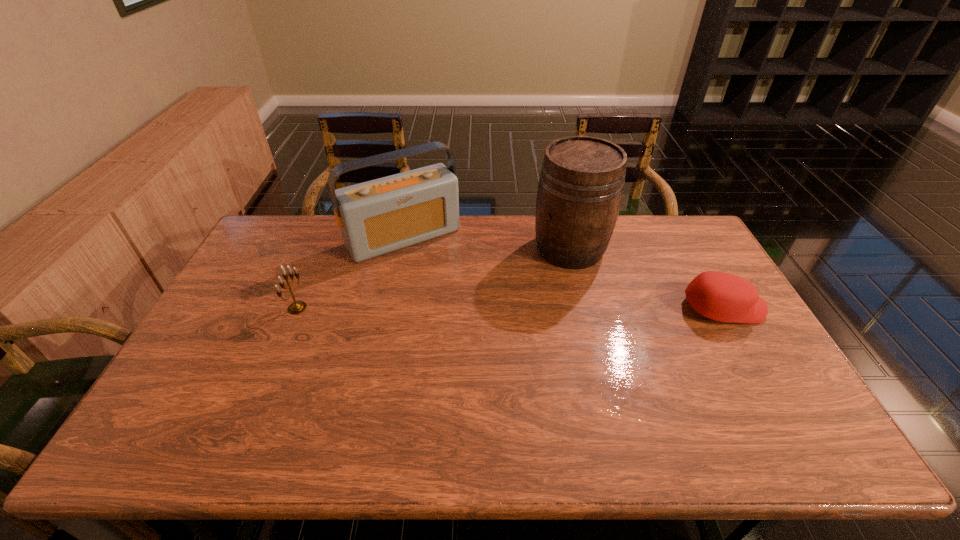
Find the location of a particular element. The image size is (960, 540). empty space between the radio receiver and the cap is located at coordinates (564, 273).

Point out which object is positioned as the second nearest to the third object from right to left. Please provide its 2D coordinates. Your answer should be formatted as a tuple, i.e. [(x, y)], where the tuple contains the x and y coordinates of a point satisfying the conditions above.

[(580, 189)]

In order to click on object that is the closest to the third object from left to right in this screenshot , I will do [724, 297].

Identify the location of free space that satisfies the following two spatial constraints: 1. on the front side of the second object from left to right; 2. on the front-facing side of the cap. pyautogui.click(x=388, y=308).

Find the location of a particular element. free space in the image that satisfies the following two spatial constraints: 1. on the front side of the third object from right to left; 2. on the front-facing side of the shortest object is located at coordinates (388, 308).

This screenshot has height=540, width=960. I want to click on vacant space that satisfies the following two spatial constraints: 1. on the back side of the radio receiver; 2. on the right side of the leftmost object, so click(327, 238).